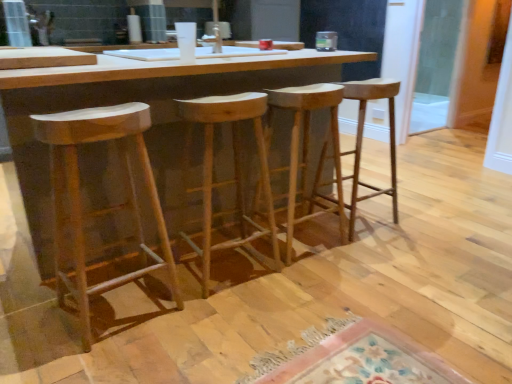
I want to click on vacant space underneath transparent glass door at right (from a real-world perspective), so coord(426,135).